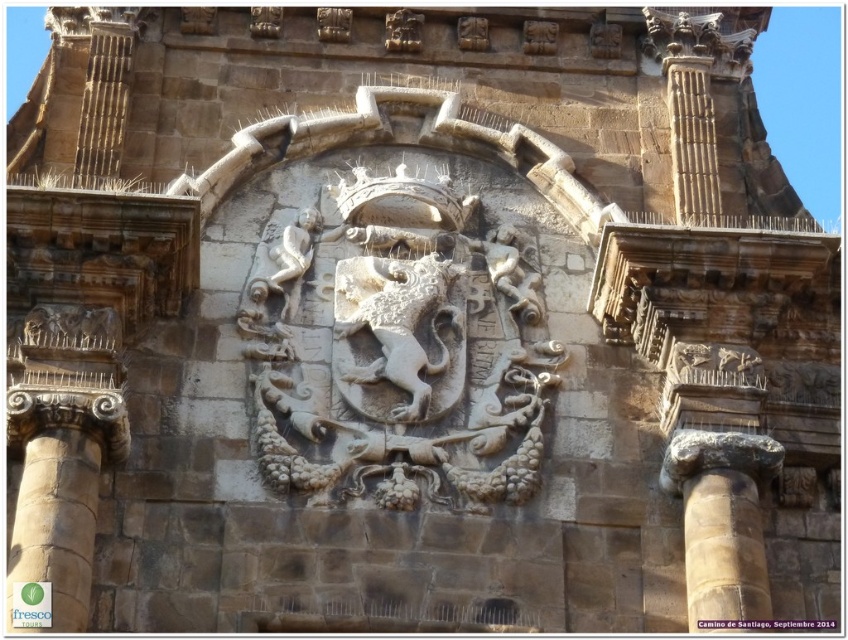
You are an architect examining the historic stone building. You notice two points marked on the facade. The first point is at coordinates point (338, 317), and the second is at point (703, 563). Which point is closer to you as you face the building?

Point (338, 317) is closer to you than point (703, 563) because it is further to the viewer.

You are an architect analyzing the symmetry of the historic stone building. The white stone crest at center is part of the design. Based on its position, can you determine if it is centered both horizontally and vertically within the stone facade?

The white stone crest at center is located at point coordinates approximately 0.542 on the x axis and 0.469 on the y axis. Since the center of the image would be at coordinates 0.5, the crest is slightly offset to the right and downward from the exact center, meaning it is not perfectly centered both horizontally and vertically within the stone facade.

You are an architect examining the historic stone building. You notice the white stone crest at center and the brown stone column at right. Which object is located to the right of the other?

The brown stone column at right is located to the right of the white stone crest at center.